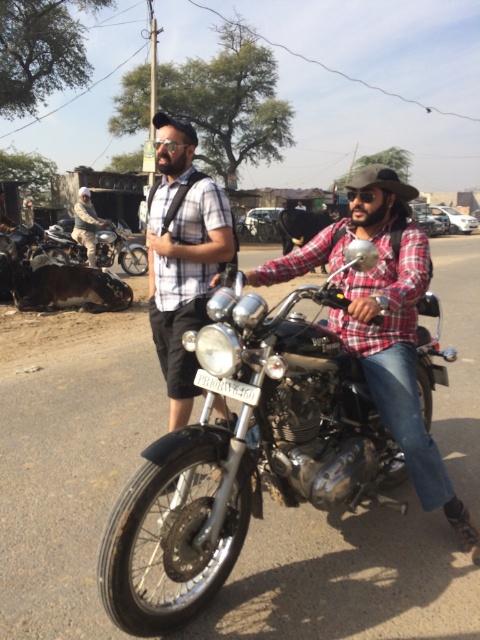
Based on the photo, between matte black shirt at center and shiny chrome motorcycle at left, which one is positioned higher?

shiny chrome motorcycle at left

Which is behind, point (171, 202) or point (143, 266)?

Point (143, 266)

Is point (191, 141) positioned before point (137, 268)?

Yes, point (191, 141) is closer to viewer.

Locate an element on the screen. The width and height of the screenshot is (480, 640). matte black shirt at center is located at coordinates (x=182, y=260).

Who is more forward, (x=348, y=280) or (x=203, y=244)?

Point (x=348, y=280) is more forward.

Measure the distance between plaid shirt at center and matte black shirt at center.

plaid shirt at center is 36.43 inches from matte black shirt at center.

This screenshot has height=640, width=480. In order to click on plaid shirt at center in this screenshot , I will do `click(384, 323)`.

Find the location of `plaid shirt at center`. plaid shirt at center is located at coordinates (384, 323).

Which is above, shiny chrome motorcycle at center or matte black helmet at upper left?

Positioned higher is matte black helmet at upper left.

Between point (187, 336) and point (85, 225), which one is positioned behind?

The point (85, 225) is behind.

This screenshot has width=480, height=640. I want to click on shiny chrome motorcycle at center, so click(245, 454).